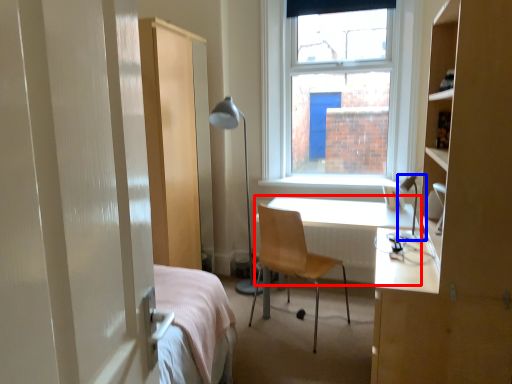
Question: Among these objects, which one is nearest to the camera, desk (highlighted by a red box) or table lamp (highlighted by a blue box)?

Choices:
 (A) desk
 (B) table lamp

Answer: (B)